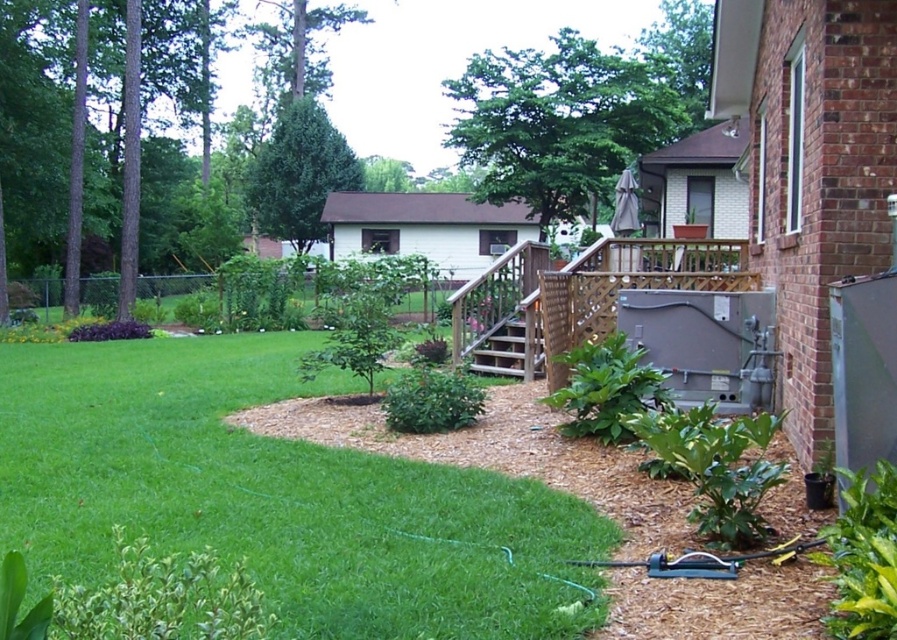
Looking at this image, who is higher up, brown wooden porch at center or wooden stairs at center?

Positioned higher is brown wooden porch at center.

Does point (668, 269) come closer to viewer compared to point (538, 339)?

That is False.

Does point (701, 248) come farther from viewer compared to point (534, 346)?

That is True.

Where is `brown wooden porch at center`? Image resolution: width=897 pixels, height=640 pixels. brown wooden porch at center is located at coordinates (576, 298).

Can you confirm if green grass at lower left is thinner than brown wooden porch at center?

No, green grass at lower left is not thinner than brown wooden porch at center.

Who is more distant from viewer, (356, 508) or (536, 307)?

Point (536, 307)

This screenshot has width=897, height=640. Describe the element at coordinates (275, 497) in the screenshot. I see `green grass at lower left` at that location.

Locate an element on the screen. green grass at lower left is located at coordinates (275, 497).

Who is positioned more to the left, green grass at lower left or wooden stairs at center?

From the viewer's perspective, green grass at lower left appears more on the left side.

Does point (484, 497) lie behind point (494, 356)?

That is False.

Identify the location of green grass at lower left. This screenshot has width=897, height=640. (275, 497).